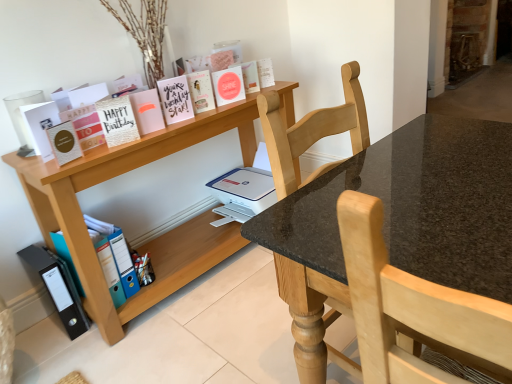
Find the location of a particular element. The height and width of the screenshot is (384, 512). empty space that is to the right of gold textured card at upper left, which is the seventh paperback book in right-to-left order is located at coordinates (161, 132).